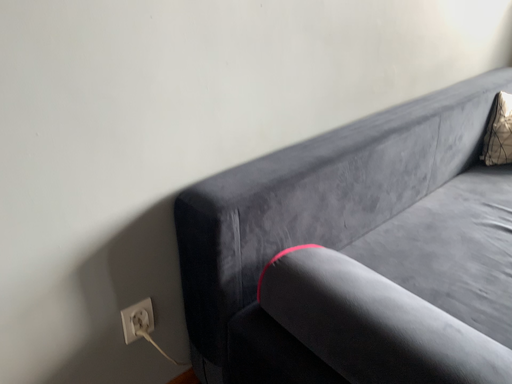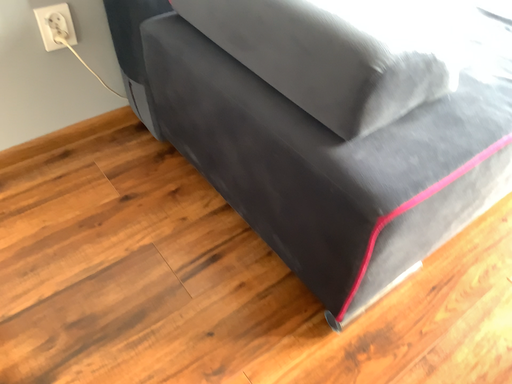
Question: How did the camera likely rotate when shooting the video?

Choices:
 (A) rotated downward
 (B) rotated upward

Answer: (A)